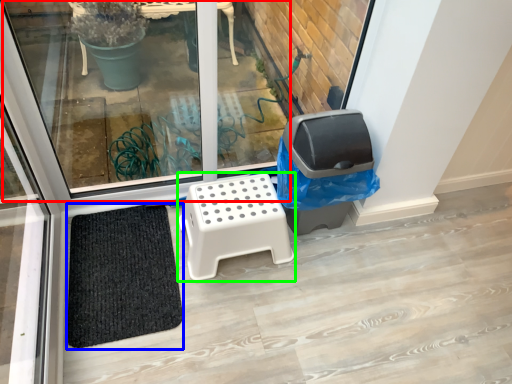
Question: Considering the real-world distances, which object is closest to window (highlighted by a red box)? doormat (highlighted by a blue box) or furniture (highlighted by a green box).

Choices:
 (A) doormat
 (B) furniture

Answer: (A)